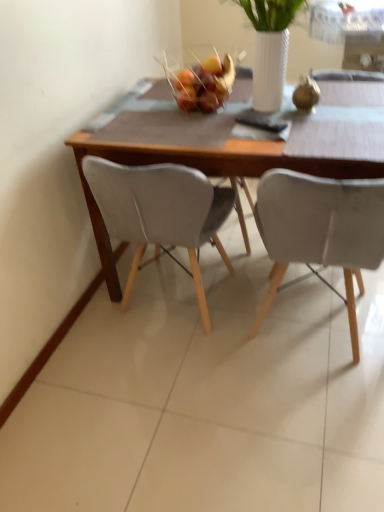
The image size is (384, 512). Find the location of `vacant area situated to the left side of glossy plastic fruit basket at center`. vacant area situated to the left side of glossy plastic fruit basket at center is located at coordinates (140, 118).